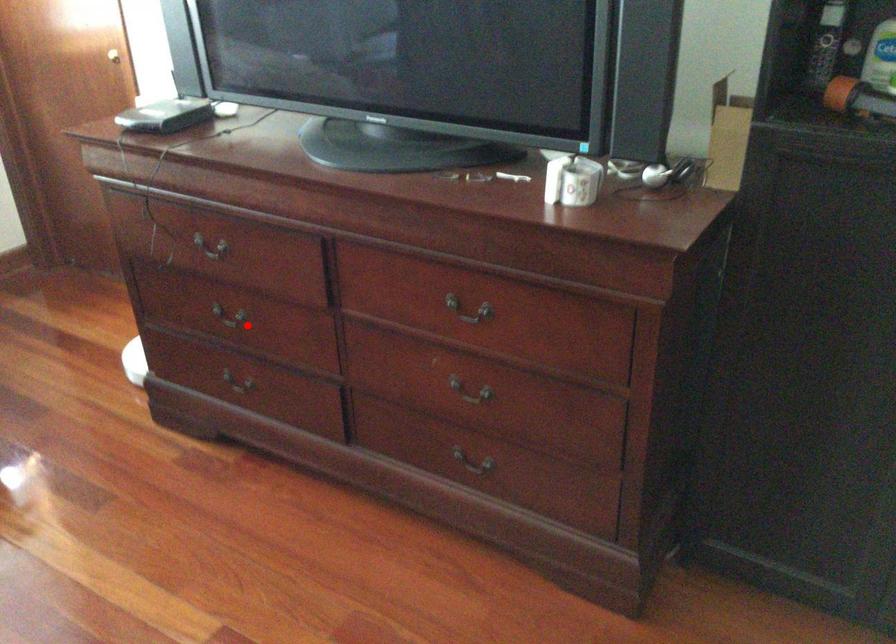
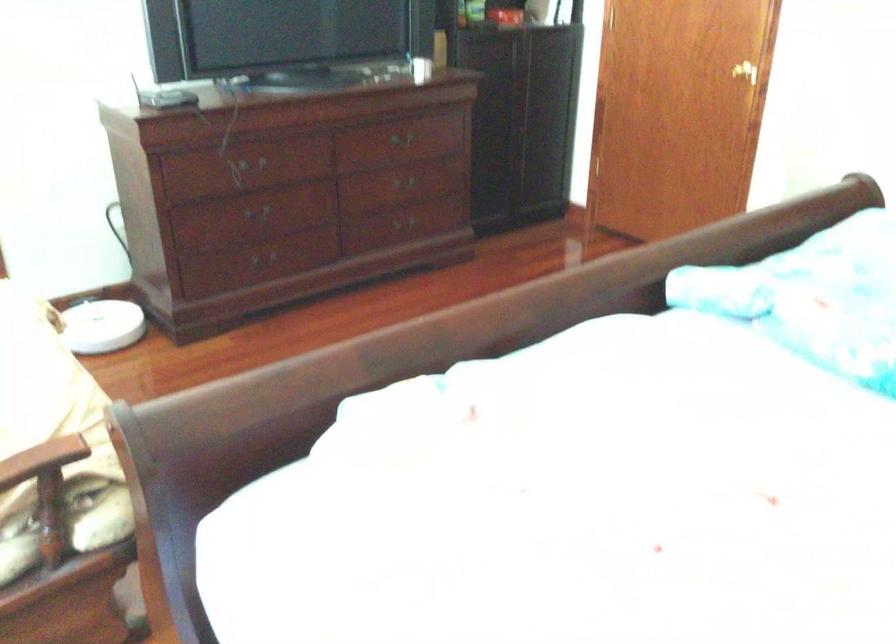
Question: I am providing you with two images of the same scene from different viewpoints. In image1, a red point is highlighted. Considering the same 3D point in image2, which of the following is correct?

Choices:
 (A) It is closer
 (B) It is farther

Answer: (B)